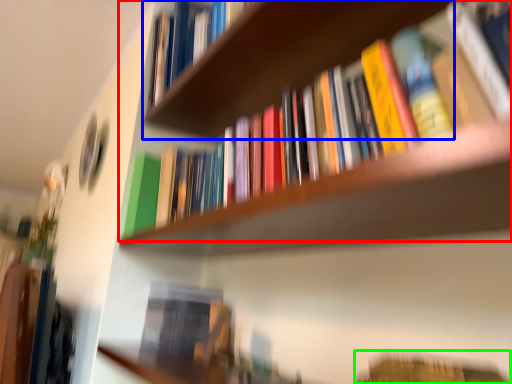
Question: Which object is positioned closest to book (highlighted by a red box)? Select from cabinet (highlighted by a blue box) and book (highlighted by a green box).

Choices:
 (A) cabinet
 (B) book

Answer: (A)